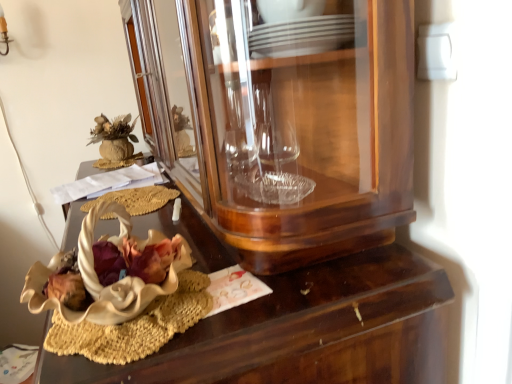
Question: Is wooden desk at center oriented towards white matte flower at center?

Choices:
 (A) no
 (B) yes

Answer: (A)

Question: Does wooden desk at center have a greater width compared to white matte flower at center?

Choices:
 (A) yes
 (B) no

Answer: (A)

Question: Considering the relative sizes of wooden desk at center and white matte flower at center in the image provided, is wooden desk at center smaller than white matte flower at center?

Choices:
 (A) yes
 (B) no

Answer: (B)

Question: Is wooden desk at center shorter than white matte flower at center?

Choices:
 (A) no
 (B) yes

Answer: (A)

Question: Is wooden desk at center bigger than white matte flower at center?

Choices:
 (A) no
 (B) yes

Answer: (B)

Question: Is transparent glass cabinet at center wider or thinner than wooden desk at center?

Choices:
 (A) thin
 (B) wide

Answer: (A)

Question: Is transparent glass cabinet at center taller or shorter than wooden desk at center?

Choices:
 (A) tall
 (B) short

Answer: (B)

Question: From the image's perspective, relative to wooden desk at center, is transparent glass cabinet at center above or below?

Choices:
 (A) below
 (B) above

Answer: (B)

Question: Relative to wooden desk at center, is transparent glass cabinet at center in front or behind?

Choices:
 (A) behind
 (B) front

Answer: (B)

Question: Looking at the image, does white matte flower at center seem bigger or smaller compared to transparent glass cabinet at center?

Choices:
 (A) big
 (B) small

Answer: (B)

Question: Is white matte flower at center in front of or behind transparent glass cabinet at center in the image?

Choices:
 (A) front
 (B) behind

Answer: (B)

Question: Is white matte flower at center wider or thinner than transparent glass cabinet at center?

Choices:
 (A) thin
 (B) wide

Answer: (A)

Question: Considering the positions of white matte flower at center and transparent glass cabinet at center in the image, is white matte flower at center taller or shorter than transparent glass cabinet at center?

Choices:
 (A) tall
 (B) short

Answer: (B)

Question: From the image's perspective, is wooden desk at center positioned above or below white matte flower at center?

Choices:
 (A) above
 (B) below

Answer: (B)

Question: Does point (245, 314) appear closer or farther from the camera than point (141, 193)?

Choices:
 (A) farther
 (B) closer

Answer: (B)